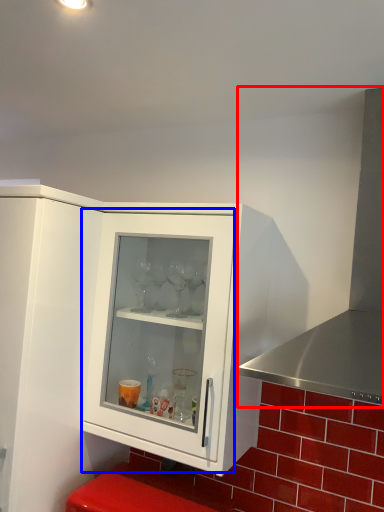
Question: Which point is further to the camera, exhaust hood (highlighted by a red box) or glass door (highlighted by a blue box)?

Choices:
 (A) exhaust hood
 (B) glass door

Answer: (B)